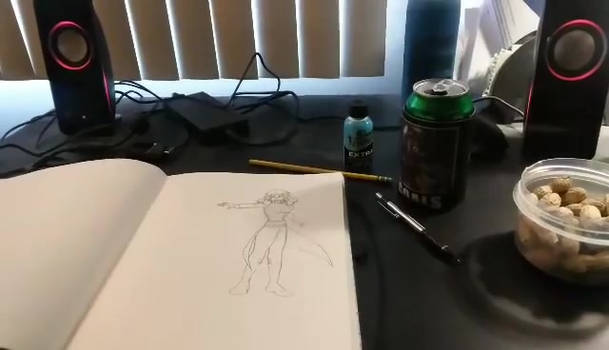
Identify the location of speaker cables. The image size is (609, 350). (198, 114).